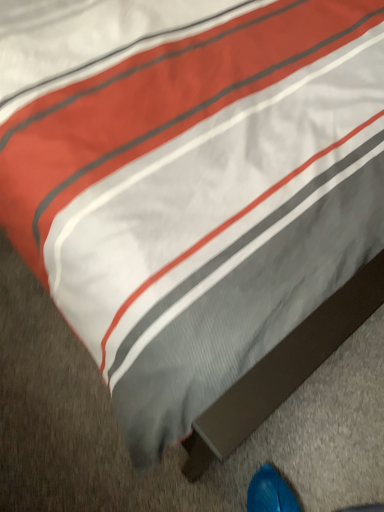
Question: Should I look upward or downward to see white fabric at center?

Choices:
 (A) up
 (B) down

Answer: (B)